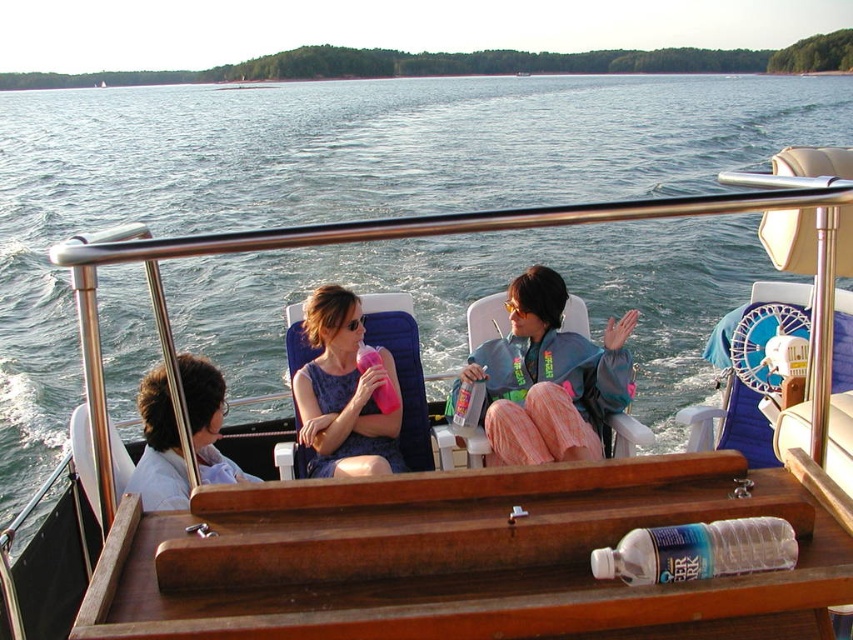
Question: Is pink fabric pants at center thinner than matte purple dress at center?

Choices:
 (A) no
 (B) yes

Answer: (A)

Question: Is pink fabric pants at center smaller than light blue shirt at center?

Choices:
 (A) yes
 (B) no

Answer: (B)

Question: Which point is closer to the camera taking this photo?

Choices:
 (A) (473, 355)
 (B) (315, 426)
 (C) (200, 451)

Answer: (C)

Question: Considering the real-world distances, which object is farthest from the light blue shirt at center?

Choices:
 (A) matte purple dress at center
 (B) pink fabric pants at center

Answer: (B)

Question: Which object is positioned closest to the pink fabric pants at center?

Choices:
 (A) matte purple dress at center
 (B) light blue shirt at center

Answer: (A)

Question: Is pink fabric pants at center positioned at the back of light blue shirt at center?

Choices:
 (A) no
 (B) yes

Answer: (B)